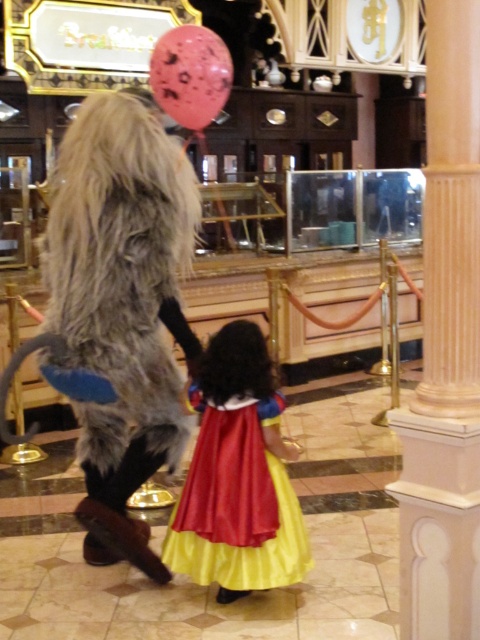
From the picture: You are a photographer setting up for a photoshoot in the scene described. You need to position a spotlight so that it illuminates both the white marble column at center and the shiny satin dress at center without any shadows. Given their positions, which object should the spotlight be directed towards first to ensure both are well lit?

The white marble column at center is located above the shiny satin dress at center, so the spotlight should be directed towards the white marble column at center first to ensure both objects receive adequate lighting.

You are a photographer standing at the entrance of the lobby. You want to take a photo of the shiny satin dress at center and the pink dotted balloon at upper center. Can you fit both in your camera frame if your camera has a maximum distance coverage of 3 meters between the nearest and farthest objects?

The shiny satin dress at center is 3.02 meters from the pink dotted balloon at upper center. Since the camera can only cover up to 3 meters, the distance between them exceeds the maximum coverage. Therefore, both objects cannot be captured in a single frame.

You are a photographer standing in the themed indoor setting. You want to take a photo of the white marble column at center and the pink dotted balloon at upper center. Based on their positions, which object should you adjust your camera to focus on first if you want to capture both in the same frame?

The white marble column at center is positioned on the right side of the pink dotted balloon at upper center, so you should focus on the pink dotted balloon at upper center first to ensure both are in the frame.